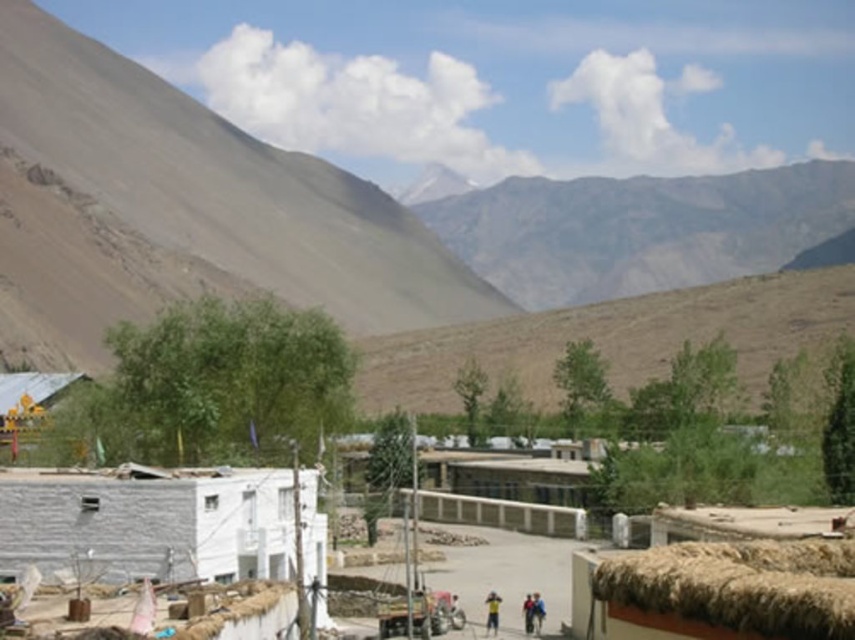
Question: Estimate the real-world distances between objects in this image. Which object is farther from the gray rocky mountain at upper center?

Choices:
 (A) blue fabric person at center
 (B) brown/dry soil mountain at upper left
 (C) white concrete wall at lower left
 (D) white concrete hut at lower left

Answer: (D)

Question: Is the position of brown/dry soil mountain at upper left less distant than that of white concrete wall at lower left?

Choices:
 (A) no
 (B) yes

Answer: (A)

Question: Which of the following is the closest to the observer?

Choices:
 (A) (75, 564)
 (B) (588, 284)
 (C) (532, 608)

Answer: (A)

Question: From the image, what is the correct spatial relationship of white concrete hut at lower left in relation to white concrete wall at lower left?

Choices:
 (A) above
 (B) below

Answer: (A)

Question: Which of the following is the farthest from the observer?

Choices:
 (A) brown/dry soil mountain at upper left
 (B) light brown fabric at center
 (C) straw thatched hut at lower right

Answer: (A)

Question: Observing the image, what is the correct spatial positioning of white concrete hut at lower left in reference to straw thatched hut at lower right?

Choices:
 (A) left
 (B) right

Answer: (A)